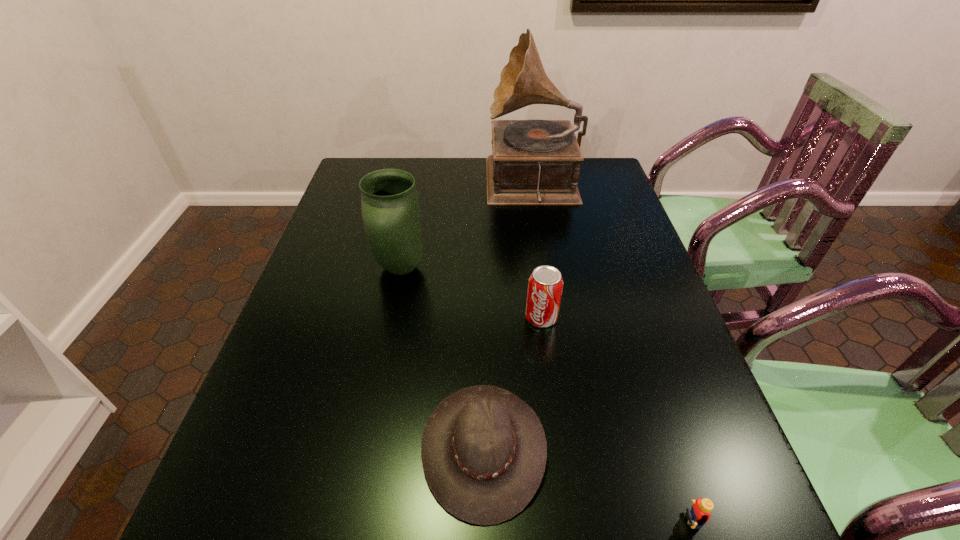
Identify the location of free space that is in between the second farthest object and the soda can. The height and width of the screenshot is (540, 960). (470, 293).

At what (x,y) coordinates should I click in order to perform the action: click on free space between the Lego and the record player. Please return your answer as a coordinate pair (x, y). The width and height of the screenshot is (960, 540). Looking at the image, I should click on (608, 353).

What are the coordinates of `blank region between the farthest object and the leftmost object` in the screenshot? It's located at (467, 227).

What are the coordinates of `free space between the Lego and the third shortest object` in the screenshot? It's located at [x=612, y=419].

In order to click on vacant space that is in between the Lego and the farthest object in this screenshot , I will do `click(608, 353)`.

In order to click on free spot between the Lego and the record player in this screenshot , I will do `click(608, 353)`.

What are the coordinates of `free space between the farthest object and the soda can` in the screenshot? It's located at (x=538, y=252).

Find the location of `blank region between the fourth nearest object and the hat`. blank region between the fourth nearest object and the hat is located at coordinates (443, 358).

Where is `empty space that is in between the hat and the Lego`? empty space that is in between the hat and the Lego is located at coordinates (583, 484).

At what (x,y) coordinates should I click in order to perform the action: click on vacant area between the hat and the fourth shortest object. Please return your answer as a coordinate pair (x, y). This screenshot has width=960, height=540. Looking at the image, I should click on (443, 358).